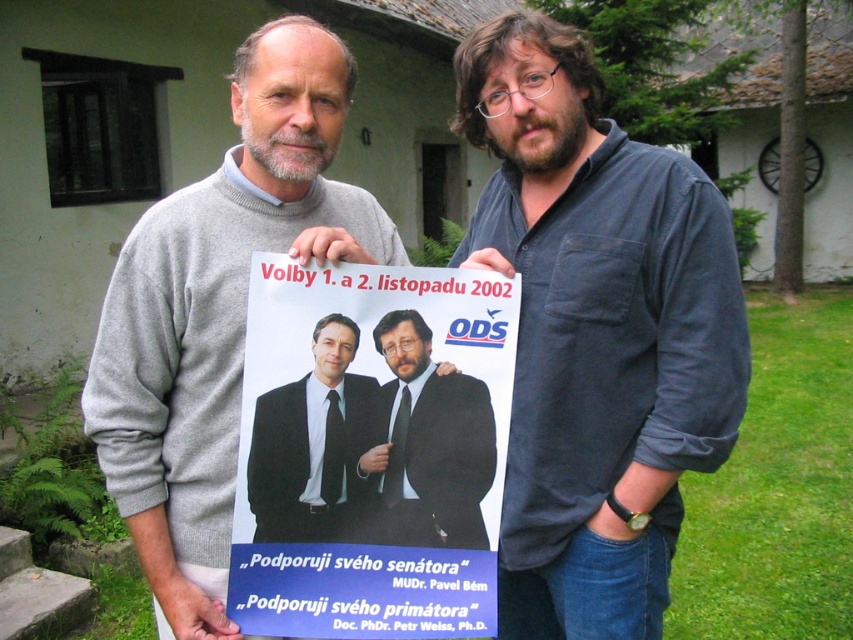
You are a photographer trying to capture a clear shot of both the gray sweater at center and the matte black suit at center from your position behind the building. Can you see both subjects simultaneously without moving your camera?

The gray sweater at center is in front of the matte black suit at center, so you cannot see both subjects simultaneously without moving your camera because the gray sweater at center is blocking the view of the matte black suit at center.